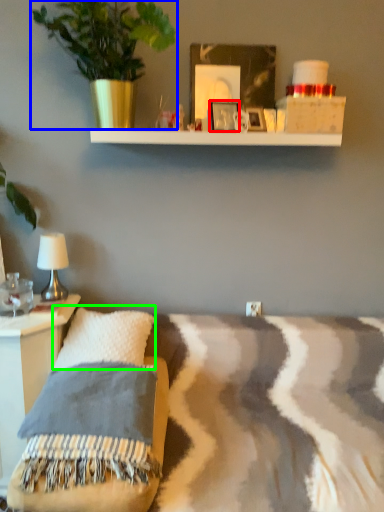
Question: Estimate the real-world distances between objects in this image. Which object is farther from picture frame (highlighted by a red box), houseplant (highlighted by a blue box) or pillow (highlighted by a green box)?

Choices:
 (A) houseplant
 (B) pillow

Answer: (B)